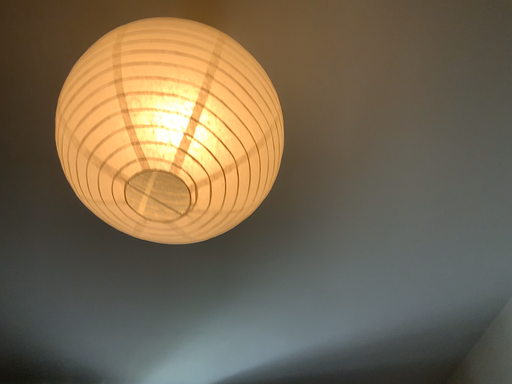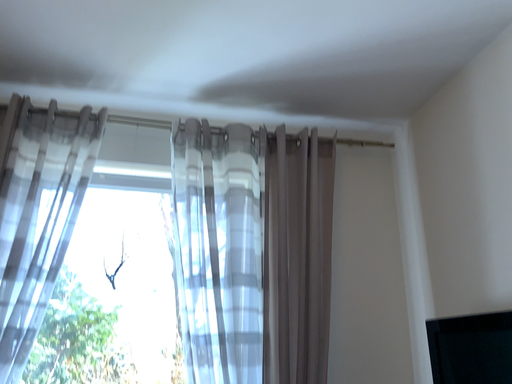
Question: Which way did the camera rotate in the video?

Choices:
 (A) rotated upward
 (B) rotated downward

Answer: (B)